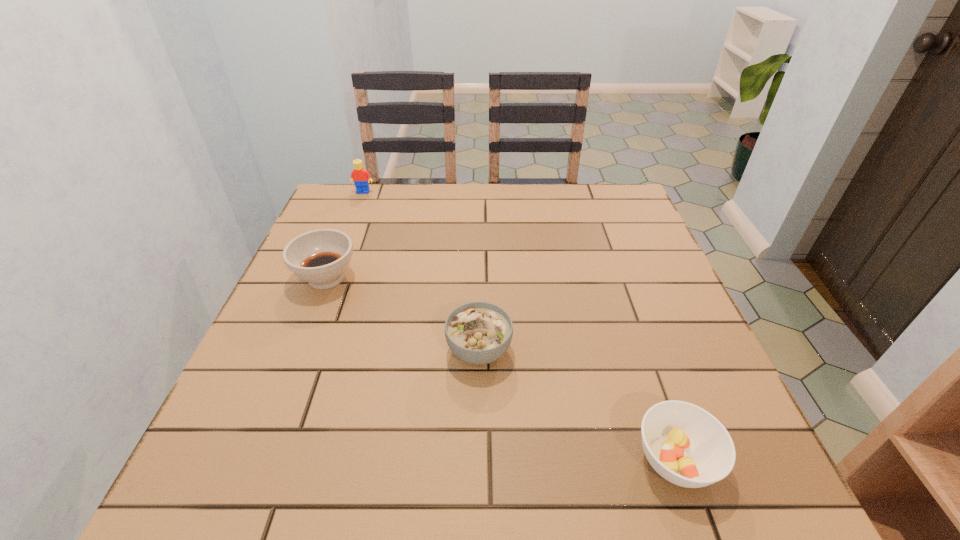
In order to click on free spot between the farthest soup bowl and the rightmost object in this screenshot , I will do `click(501, 369)`.

Locate which object is the second closest to the second nearest soup bowl. Please provide its 2D coordinates. Your answer should be formatted as a tuple, i.e. [(x, y)], where the tuple contains the x and y coordinates of a point satisfying the conditions above.

[(320, 257)]

Identify the location of object that is the second nearest to the Lego. This screenshot has height=540, width=960. (478, 333).

Locate an element on the screen. Image resolution: width=960 pixels, height=540 pixels. the closest soup bowl to the tallest object is located at coordinates pos(320,257).

Locate an element on the screen. soup bowl that is the third closest one to the Lego is located at coordinates (686, 445).

Find the location of a particular element. This screenshot has width=960, height=540. vacant area that satisfies the following two spatial constraints: 1. on the face of the Lego; 2. on the right side of the third farthest object is located at coordinates [x=301, y=350].

This screenshot has width=960, height=540. I want to click on vacant space that satisfies the following two spatial constraints: 1. on the face of the third object from left to right; 2. on the right side of the farthest object, so click(301, 350).

Find the location of a particular element. free space that satisfies the following two spatial constraints: 1. on the face of the tallest object; 2. on the left side of the nearest object is located at coordinates pos(259,460).

This screenshot has width=960, height=540. In order to click on vacant space that satisfies the following two spatial constraints: 1. on the face of the shortest soup bowl; 2. on the left side of the farthest object in this screenshot , I will do `click(259, 460)`.

Identify the location of free space that satisfies the following two spatial constraints: 1. on the face of the Lego; 2. on the right side of the shortest soup bowl. (259, 460).